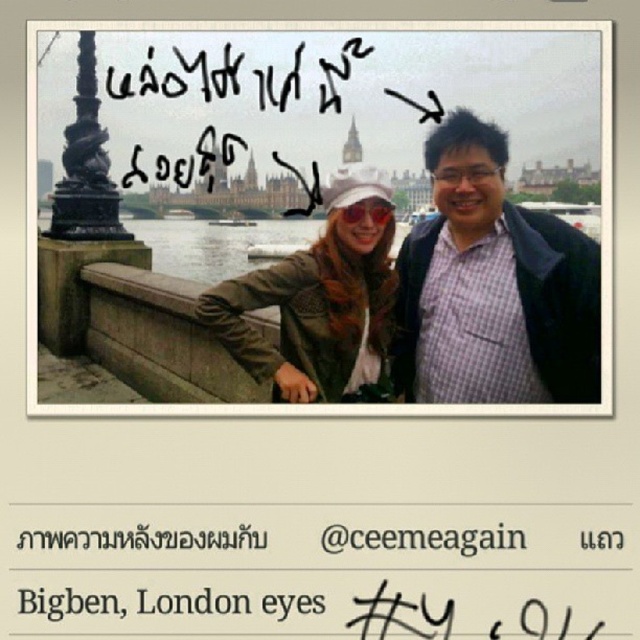
Question: Which point appears farthest from the camera in this image?

Choices:
 (A) (570, 289)
 (B) (161, 296)

Answer: (B)

Question: Does matte plaid shirt at center appear on the left side of matte olive-green jacket at center?

Choices:
 (A) no
 (B) yes

Answer: (A)

Question: Which point appears farthest from the camera in this image?

Choices:
 (A) (346, 282)
 (B) (508, 294)
 (C) (186, 372)

Answer: (C)

Question: Is matte plaid shirt at center closer to the viewer compared to concrete ledge at lower left?

Choices:
 (A) no
 (B) yes

Answer: (B)

Question: Which point appears farthest from the camera in this image?

Choices:
 (A) (528, 232)
 (B) (106, 362)
 (C) (369, 358)

Answer: (B)

Question: Is matte plaid shirt at center above concrete ledge at lower left?

Choices:
 (A) no
 (B) yes

Answer: (B)